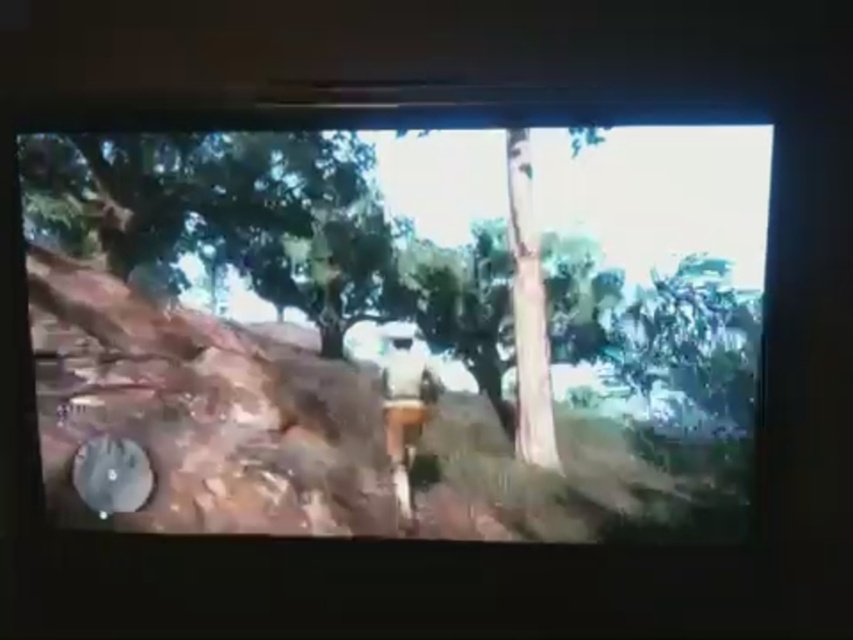
You are a game developer designing a new level for this outdoor scene. You need to ensure that the matte white helmet at center and the white matte shirt at center are visible to players. Considering their sizes, which object should you place closer to the camera to maintain visibility?

The matte white helmet at center is bigger than the white matte shirt at center, so you should place the white matte shirt at center closer to the camera to ensure it remains visible since it is smaller.

You are a character in the game and want to jump from the point at coordinates point (454, 364) to the camera position. If your jump height is 2 meters, will you be able to reach the camera?

The distance between point (454, 364) and the camera is 1.80 meters. Since your jump height is 2 meters, which is greater than the required distance, you will be able to reach the camera.

You are a game developer checking the character model in the game scene. You notice the matte white helmet at center and the white matte shirt at center. Which object is closer to the camera?

The matte white helmet at center is closer to the camera than the white matte shirt at center because it is in front of it.